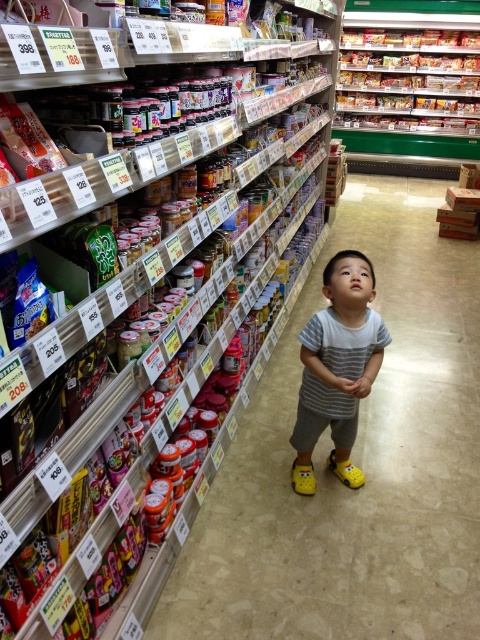
Question: Does metallic silver snack at upper right appear under striped cotton shirt at center?

Choices:
 (A) no
 (B) yes

Answer: (A)

Question: Which point is farther to the camera?

Choices:
 (A) [x=456, y=67]
 (B) [x=358, y=365]

Answer: (A)

Question: Is metallic silver snack at upper right smaller than striped cotton shirt at center?

Choices:
 (A) yes
 (B) no

Answer: (B)

Question: Which object appears closest to the camera in this image?

Choices:
 (A) striped cotton shirt at center
 (B) metallic silver snack at upper right

Answer: (A)

Question: Where is metallic silver snack at upper right located in relation to striped cotton shirt at center in the image?

Choices:
 (A) right
 (B) left

Answer: (A)